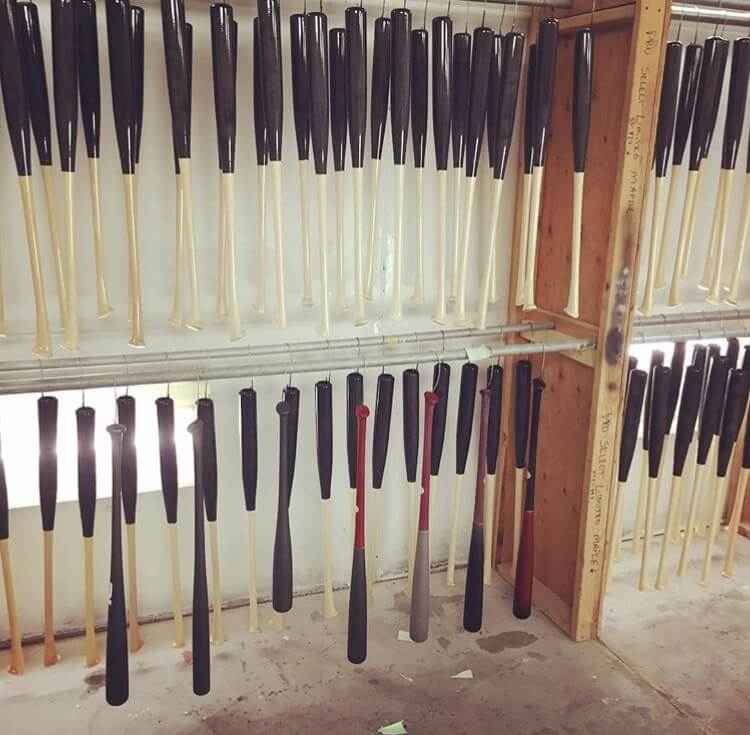
Find the location of a particular element. This screenshot has width=750, height=735. light is located at coordinates (22, 444).